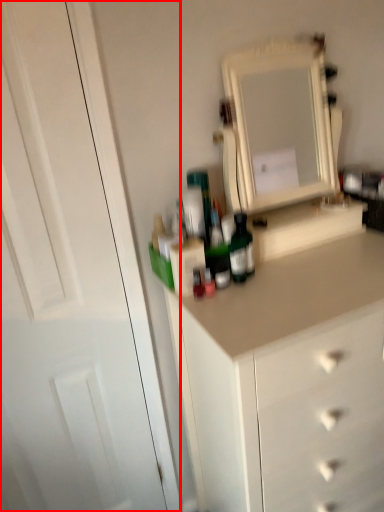
Question: Where is glass door (annotated by the red box) located in relation to medicine cabinet in the image?

Choices:
 (A) right
 (B) left

Answer: (B)